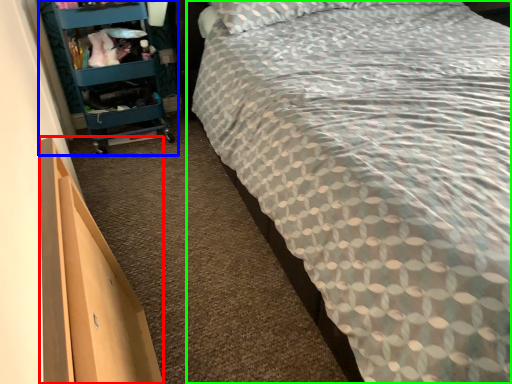
Question: Which is nearer to the drawer (highlighted by a red box)? furniture (highlighted by a blue box) or bed (highlighted by a green box).

Choices:
 (A) furniture
 (B) bed

Answer: (B)